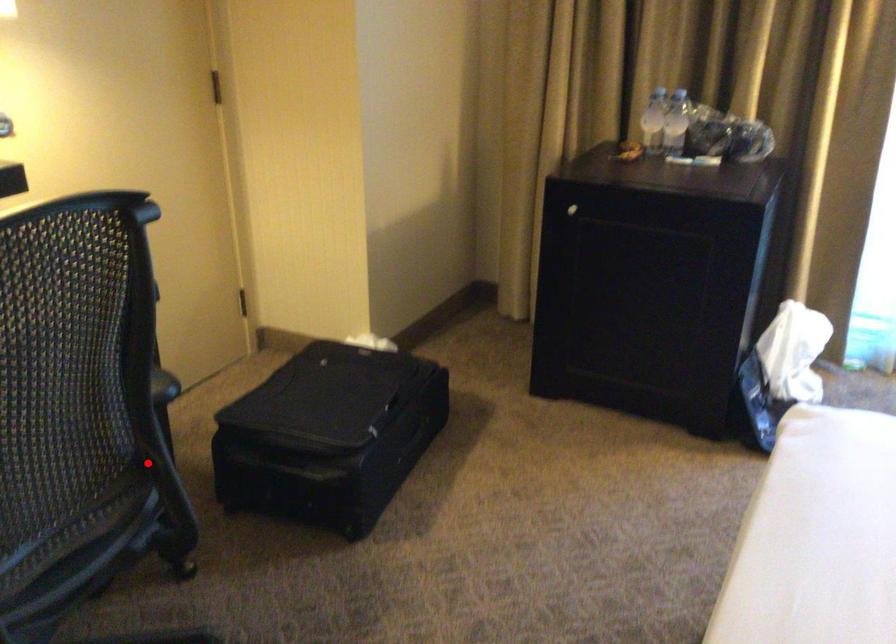
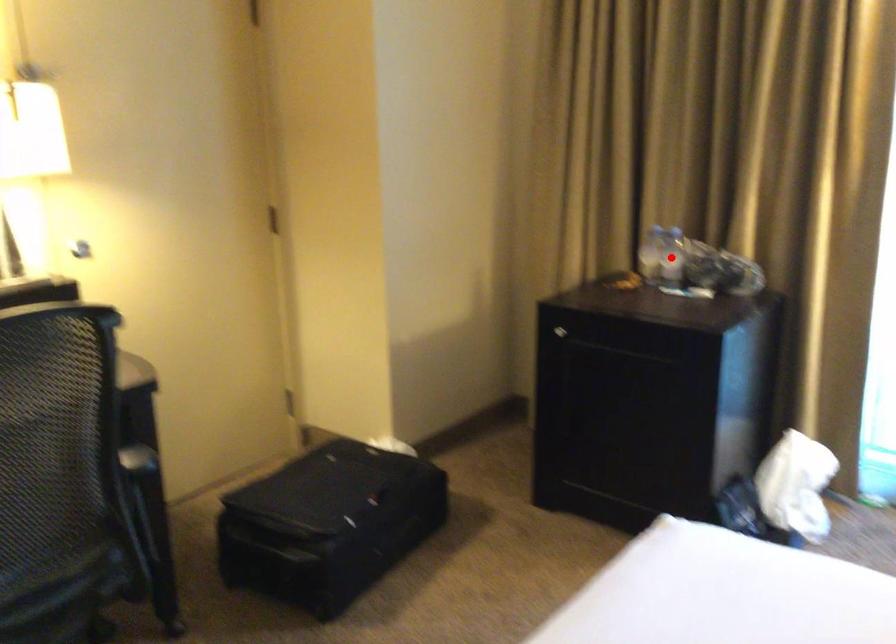
I am providing you with two images of the same scene from different viewpoints. A red point is marked on the first image and another point is marked on the second image. Is the red point in image1 aligned with the point shown in image2?

No